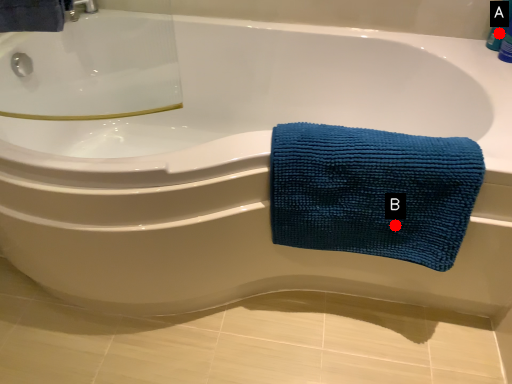
Question: Two points are circled on the image, labeled by A and B beside each circle. Which point is closer to the camera?

Choices:
 (A) A is closer
 (B) B is closer

Answer: (B)